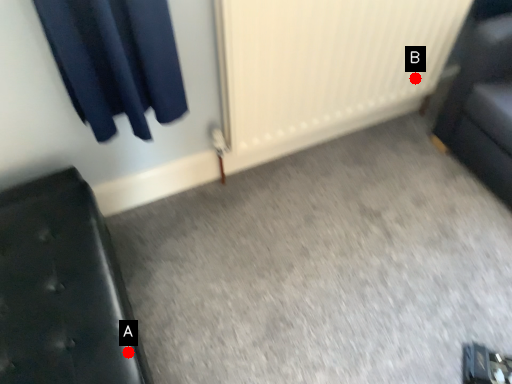
Question: Two points are circled on the image, labeled by A and B beside each circle. Which point is closer to the camera taking this photo?

Choices:
 (A) A is closer
 (B) B is closer

Answer: (A)